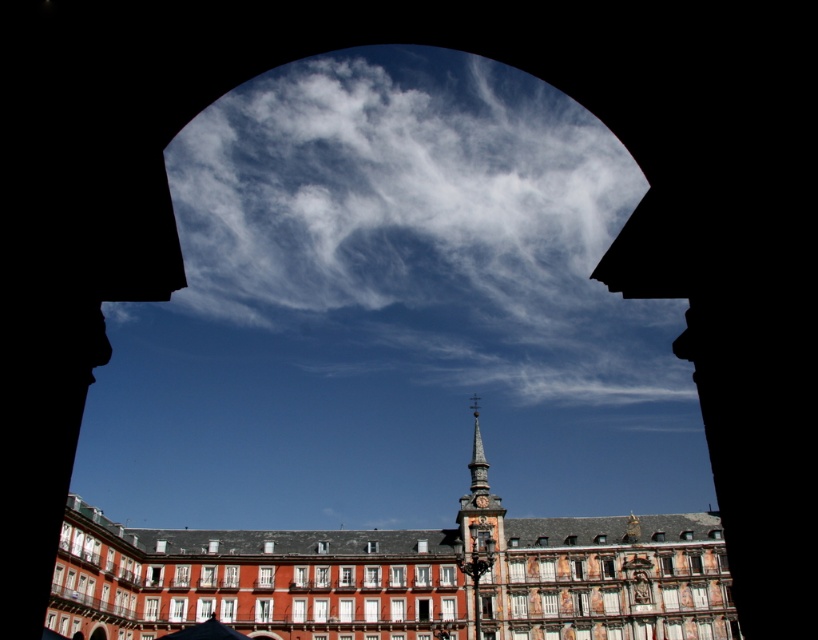
You are standing at the entrance of the passageway with an arched opening. You see the smooth red brick building at center and the dark blue fabric umbrella at lower center. Which object is taller?

The smooth red brick building at center is taller than the dark blue fabric umbrella at lower center.

Consider the image. You are standing in front of an archway that leads to a historic building. The archway has a point labeled as point [399,579]. Where is the smooth red brick building at center located in relation to this point?

The smooth red brick building at center is located at point [399,579].

You are an architect designing a new building that must fit through a narrow alleyway. You have a model of the building that includes both the polished stone clock tower at center and the smooth gray spire at center. Which of these two structures would you need to adjust to ensure it fits within the alleyway width?

The polished stone clock tower at center is wider than the smooth gray spire at center, so you would need to adjust the width of the polished stone clock tower at center to ensure it fits within the alleyway width.